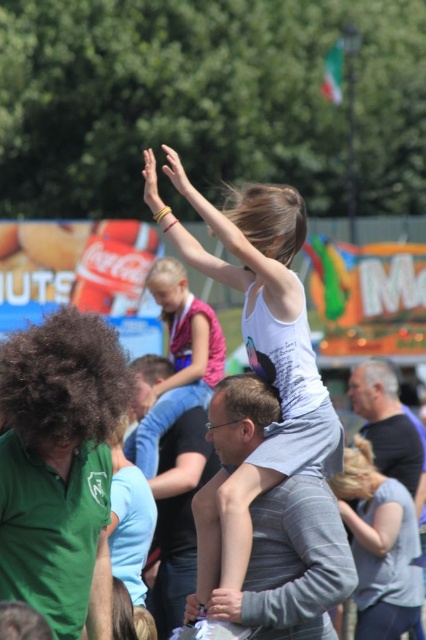
Is light blue fabric shirt at center in front of pink fabric dress at upper center?

Yes, it is in front of pink fabric dress at upper center.

Can you confirm if light blue fabric shirt at center is smaller than pink fabric dress at upper center?

Yes.

Does point (359, 496) come in front of point (169, 266)?

Yes, point (359, 496) is in front of point (169, 266).

Where is `light blue fabric shirt at center`? This screenshot has height=640, width=426. light blue fabric shirt at center is located at coordinates (379, 532).

Can you confirm if green matte shirt at left is smaller than light blue fabric shirt at center?

No, green matte shirt at left is not smaller than light blue fabric shirt at center.

Who is taller, green matte shirt at left or light blue fabric shirt at center?

With more height is green matte shirt at left.

The image size is (426, 640). I want to click on green matte shirt at left, so tap(60, 467).

At what (x,y) coordinates should I click in order to perform the action: click on green matte shirt at left. Please return your answer as a coordinate pair (x, y). Image resolution: width=426 pixels, height=640 pixels. Looking at the image, I should click on (60, 467).

What do you see at coordinates (255, 358) in the screenshot? Image resolution: width=426 pixels, height=640 pixels. I see `white matte tank top at center` at bounding box center [255, 358].

Can you confirm if white matte tank top at center is positioned to the left of pink fabric dress at upper center?

No, white matte tank top at center is not to the left of pink fabric dress at upper center.

What do you see at coordinates (255, 358) in the screenshot? The width and height of the screenshot is (426, 640). I see `white matte tank top at center` at bounding box center [255, 358].

I want to click on white matte tank top at center, so click(x=255, y=358).